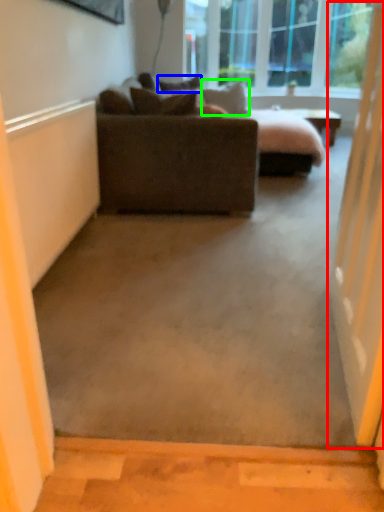
Question: Which object is positioned closest to screen door (highlighted by a red box)? Select from pillow (highlighted by a blue box) and pillow (highlighted by a green box).

Choices:
 (A) pillow
 (B) pillow

Answer: (A)